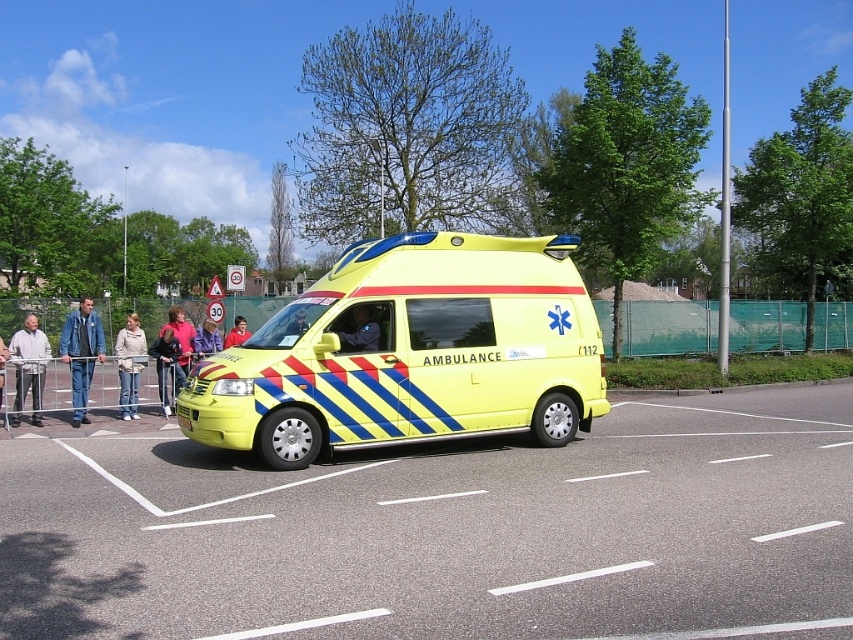
Does blue denim jacket at left appear on the left side of light beige sweater at center?

Correct, you'll find blue denim jacket at left to the left of light beige sweater at center.

Is the position of blue denim jacket at left more distant than that of light beige sweater at center?

No, it is in front of light beige sweater at center.

Measure the distance between blue denim jacket at left and camera.

A distance of 12.18 meters exists between blue denim jacket at left and camera.

The width and height of the screenshot is (853, 640). Find the location of `blue denim jacket at left`. blue denim jacket at left is located at coordinates (80, 353).

Who is positioned more to the right, yellow asphalt at center or denim jacket at center?

From the viewer's perspective, yellow asphalt at center appears more on the right side.

Is yellow asphalt at center above denim jacket at center?

Incorrect, yellow asphalt at center is not positioned above denim jacket at center.

Who is more forward, [604,467] or [202,333]?

Positioned in front is point [604,467].

Find the location of a particular element. The width and height of the screenshot is (853, 640). yellow asphalt at center is located at coordinates [445, 531].

Is blue denim jacket at left wider than matte yellow helmet at center?

Indeed, blue denim jacket at left has a greater width compared to matte yellow helmet at center.

Does blue denim jacket at left have a lesser width compared to matte yellow helmet at center?

No.

Between point (61, 358) and point (303, 314), which one is positioned behind?

Positioned behind is point (61, 358).

Locate an element on the screen. blue denim jacket at left is located at coordinates (80, 353).